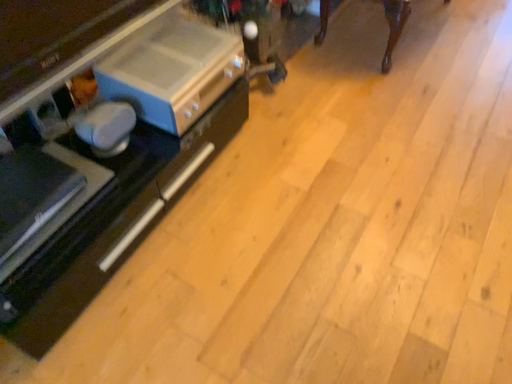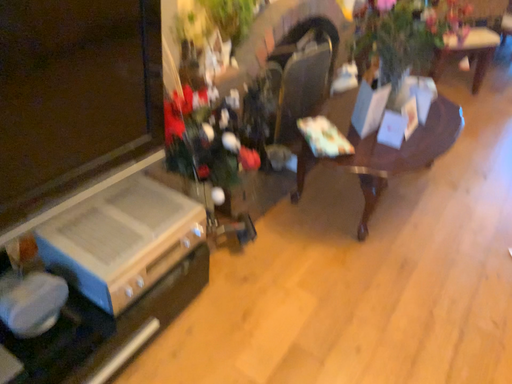
Question: Which way did the camera rotate in the video?

Choices:
 (A) rotated upward
 (B) rotated downward

Answer: (A)